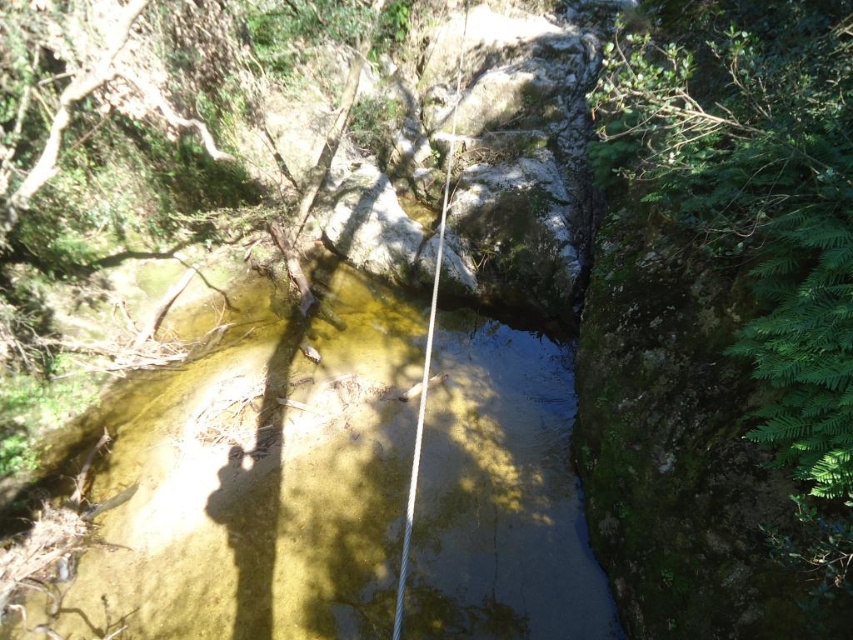
You are standing at the edge of the stream and want to cross it to the other side. There is a point marked at coordinates point (x=259, y=480). What is the condition of the water at that point?

The water at point (x=259, y=480) is translucent and yellowish, which suggests it might be shallower or clearer than other areas, making it potentially easier to cross safely.

You are a hiker trying to cross the stream safely. You notice the translucent yellowish water at center and the white rope at center. Which object should you avoid stepping on to prevent slipping?

You should avoid stepping on the translucent yellowish water at center because it is to the right of the white rope at center, which may indicate it is flowing over smooth rocks or debris, increasing the risk of slipping.